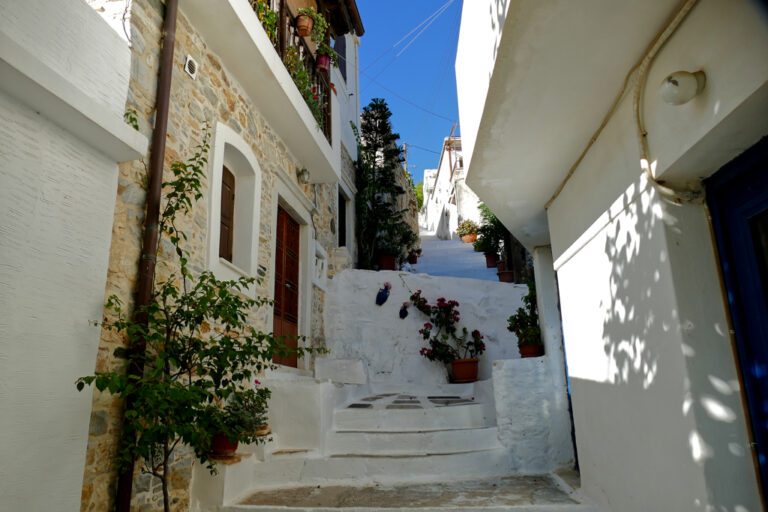
Locate an element on the screen. This screenshot has height=512, width=768. light is located at coordinates (581, 303).